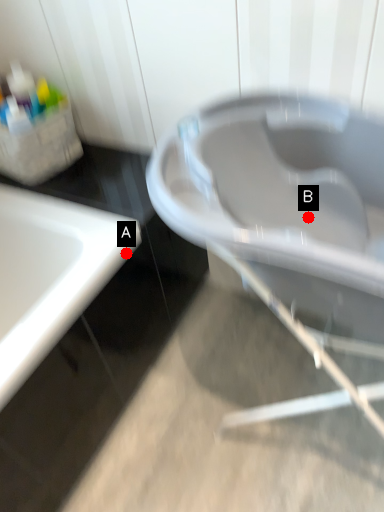
Question: Two points are circled on the image, labeled by A and B beside each circle. Which point is closer to the camera?

Choices:
 (A) A is closer
 (B) B is closer

Answer: (B)